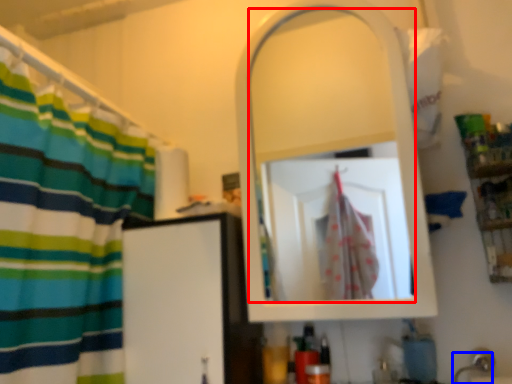
Question: Which object is further to the camera taking this photo, mirror (highlighted by a red box) or faucet (highlighted by a blue box)?

Choices:
 (A) mirror
 (B) faucet

Answer: (A)